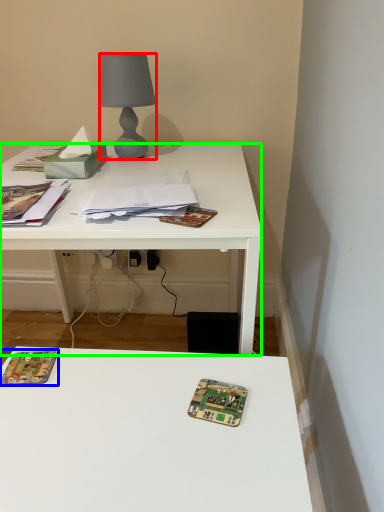
Question: Considering the real-world distances, which object is farthest from lamp (highlighted by a red box)? paperback book (highlighted by a blue box) or desk (highlighted by a green box)?

Choices:
 (A) paperback book
 (B) desk

Answer: (A)